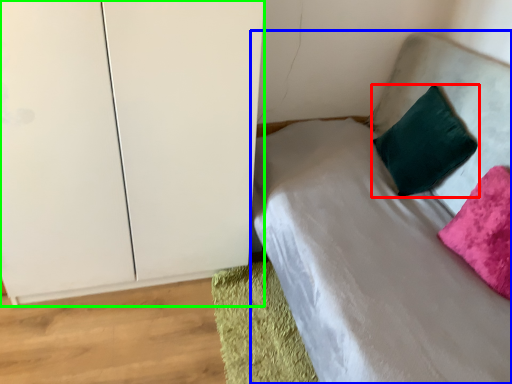
Question: Which object is positioned closest to pillow (highlighted by a red box)? Select from bed (highlighted by a blue box) and dresser (highlighted by a green box).

Choices:
 (A) bed
 (B) dresser

Answer: (A)